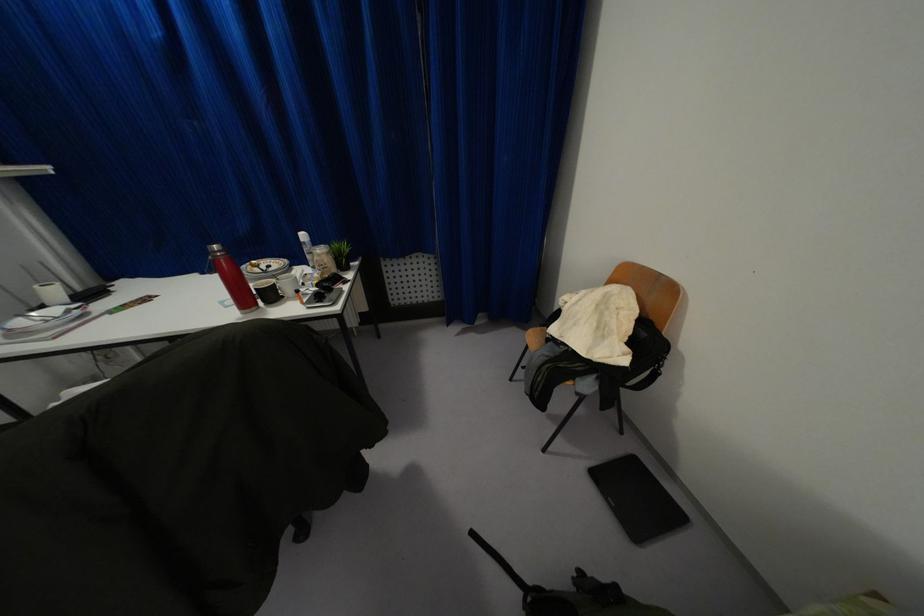
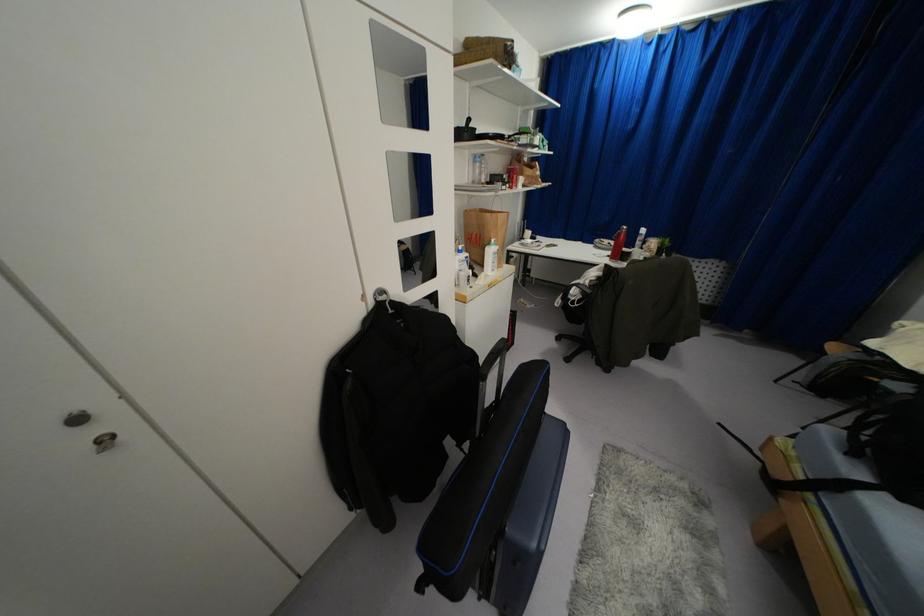
Find the pixel in the second image that matches pixel 215 262 in the first image.

(618, 233)